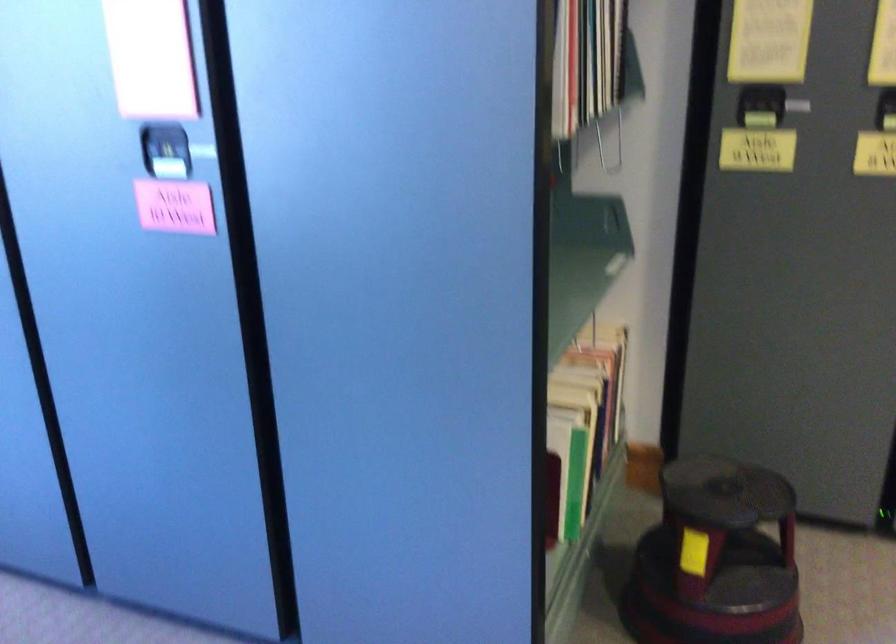
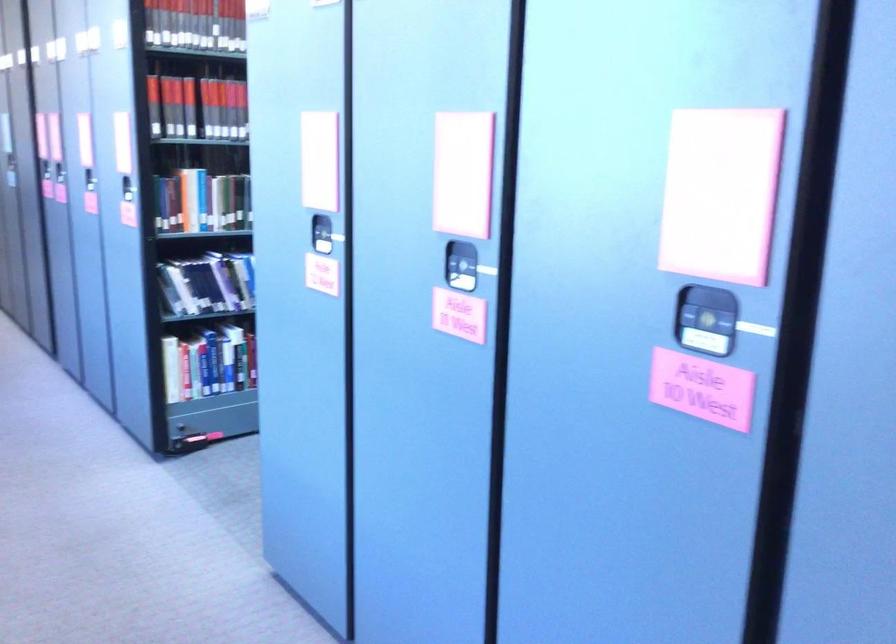
Question: The camera is either moving clockwise (left) or counter-clockwise (right) around the object. The first image is from the beginning of the video and the second image is from the end. Is the camera moving left or right when shooting the video?

Choices:
 (A) Left
 (B) Right

Answer: (B)